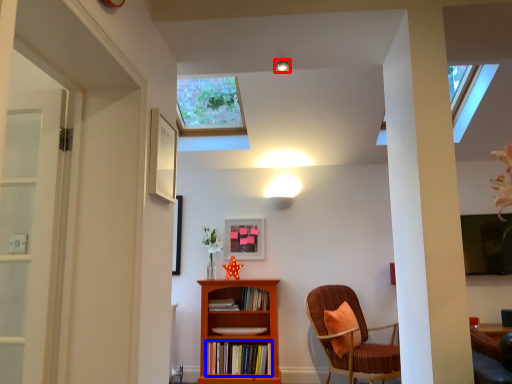
Question: Which of the following is the closest to the observer, light fixture (highlighted by a red box) or book (highlighted by a blue box)?

Choices:
 (A) light fixture
 (B) book

Answer: (A)